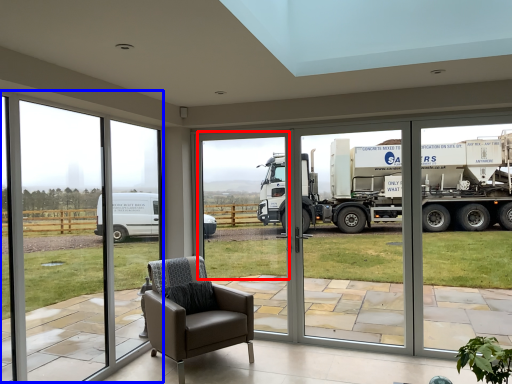
Question: Which object appears closest to the camera in this image, window screen (highlighted by a red box) or window frame (highlighted by a blue box)?

Choices:
 (A) window screen
 (B) window frame

Answer: (B)